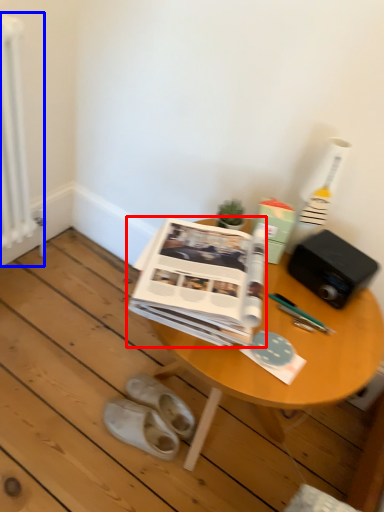
Question: Which object appears closest to the camera in this image, paperback book (highlighted by a red box) or radiator (highlighted by a blue box)?

Choices:
 (A) paperback book
 (B) radiator

Answer: (A)